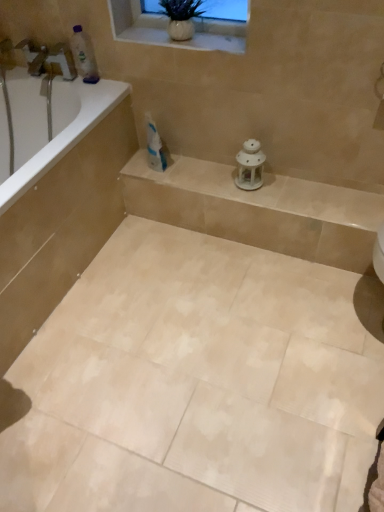
Question: Is white ceramic vase at upper center completely or partially inside translucent plastic bottle at upper left?

Choices:
 (A) yes
 (B) no

Answer: (B)

Question: Is translucent plastic bottle at upper left in contact with white ceramic vase at upper center?

Choices:
 (A) no
 (B) yes

Answer: (A)

Question: From a real-world perspective, is translucent plastic bottle at upper left under white ceramic vase at upper center?

Choices:
 (A) no
 (B) yes

Answer: (B)

Question: From a real-world perspective, is translucent plastic bottle at upper left physically above white ceramic vase at upper center?

Choices:
 (A) no
 (B) yes

Answer: (A)

Question: Considering the relative sizes of translucent plastic bottle at upper left and white ceramic vase at upper center in the image provided, is translucent plastic bottle at upper left smaller than white ceramic vase at upper center?

Choices:
 (A) yes
 (B) no

Answer: (A)

Question: Choose the correct answer: Is white glossy bathtub at left inside white ceramic vase at upper center or outside it?

Choices:
 (A) outside
 (B) inside

Answer: (A)

Question: Would you say white glossy bathtub at left is to the left or to the right of white ceramic vase at upper center in the picture?

Choices:
 (A) right
 (B) left

Answer: (B)

Question: Is white glossy bathtub at left taller or shorter than white ceramic vase at upper center?

Choices:
 (A) tall
 (B) short

Answer: (A)

Question: From the image's perspective, is white glossy bathtub at left located above or below white ceramic vase at upper center?

Choices:
 (A) below
 (B) above

Answer: (A)

Question: In terms of width, does white glossy toothpaste at center look wider or thinner when compared to white porcelain lantern at center?

Choices:
 (A) thin
 (B) wide

Answer: (A)

Question: From a real-world perspective, is white glossy toothpaste at center above or below white porcelain lantern at center?

Choices:
 (A) above
 (B) below

Answer: (A)

Question: Visually, is white glossy toothpaste at center positioned to the left or to the right of white porcelain lantern at center?

Choices:
 (A) left
 (B) right

Answer: (A)

Question: Is white glossy toothpaste at center taller or shorter than white porcelain lantern at center?

Choices:
 (A) tall
 (B) short

Answer: (A)

Question: Is beige ceramic tile at center situated inside white glossy bathtub at upper left or outside?

Choices:
 (A) inside
 (B) outside

Answer: (B)

Question: Visually, is beige ceramic tile at center positioned to the left or to the right of white glossy bathtub at upper left?

Choices:
 (A) left
 (B) right

Answer: (B)